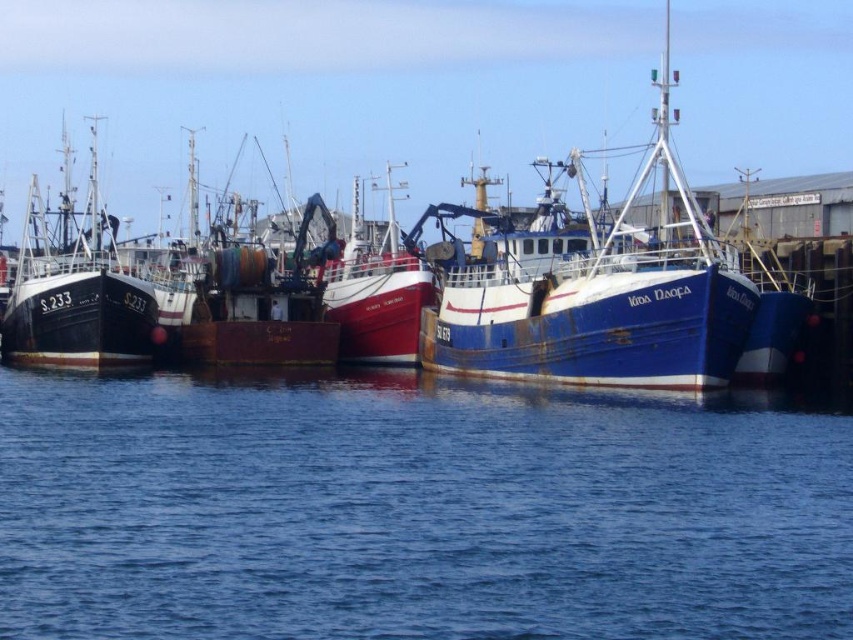
Is blue rusty boat at center below rusty metal boat at center?

No, blue rusty boat at center is not below rusty metal boat at center.

Does point (622, 372) lie in front of point (235, 241)?

Yes, it is.

The width and height of the screenshot is (853, 640). I want to click on blue rusty boat at center, so click(590, 289).

The width and height of the screenshot is (853, 640). In order to click on blue rusty boat at center in this screenshot , I will do `click(590, 289)`.

Who is lower down, blue water at center or black matte boat at left?

blue water at center is lower down.

Who is taller, blue water at center or black matte boat at left?

With more height is black matte boat at left.

Which is in front, point (572, 628) or point (68, 337)?

Point (572, 628) is more forward.

You are a GUI agent. You are given a task and a screenshot of the screen. Output one action in this format:
    pyautogui.click(x=<x>, y=<y>)
    Task: Click on the blue water at center
    The image size is (853, 640).
    Given the screenshot: What is the action you would take?
    pyautogui.click(x=415, y=512)

Which is more to the left, black matte boat at left or rusty metal boat at center?

black matte boat at left

How far apart are black matte boat at left and rusty metal boat at center?

They are 13.73 meters apart.

Image resolution: width=853 pixels, height=640 pixels. I want to click on black matte boat at left, so click(x=74, y=284).